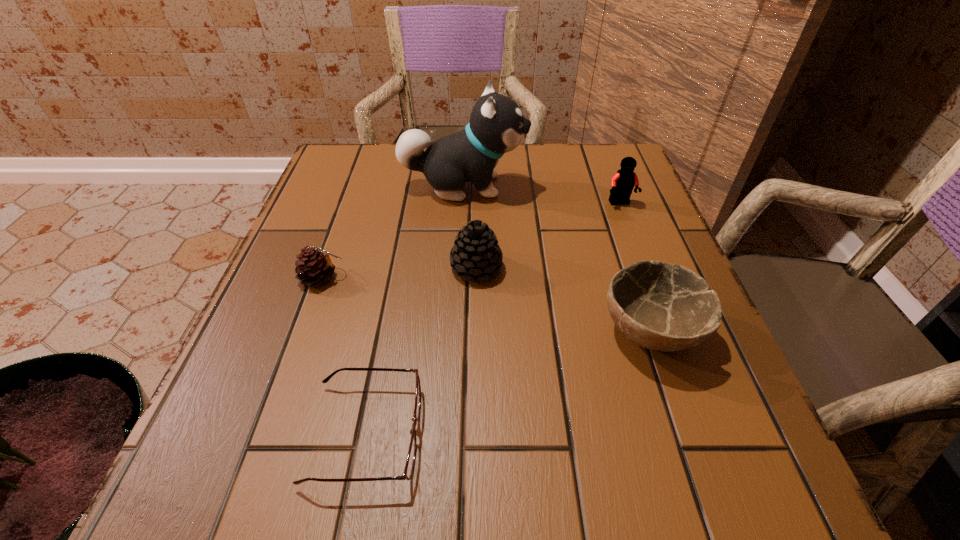
Where is `free space located on the front-facing side of the Lego`? This screenshot has height=540, width=960. free space located on the front-facing side of the Lego is located at coordinates (659, 305).

You are a GUI agent. You are given a task and a screenshot of the screen. Output one action in this format:
    pyautogui.click(x=<x>, y=<y>)
    Task: Click on the vacant region located at the narrow end of the taller pinecone
    
    Given the screenshot: What is the action you would take?
    (619, 268)

You are a GUI agent. You are given a task and a screenshot of the screen. Output one action in this format:
    pyautogui.click(x=<x>, y=<y>)
    Task: Click on the blank space located 0.150m on the left of the third shortest object
    
    Given the screenshot: What is the action you would take?
    pyautogui.click(x=513, y=332)

Image resolution: width=960 pixels, height=540 pixels. In order to click on free spot located with a leaf charm attached to the leftmost object in this screenshot , I will do `click(454, 278)`.

Locate an element on the screen. free space located on the lenses of the shortest object is located at coordinates (609, 433).

Where is `object that is at the far edge`? The width and height of the screenshot is (960, 540). object that is at the far edge is located at coordinates (496, 126).

The height and width of the screenshot is (540, 960). I want to click on object situated at the near edge, so click(x=410, y=461).

Where is `pinecone that is at the left edge`? Image resolution: width=960 pixels, height=540 pixels. pinecone that is at the left edge is located at coordinates (314, 267).

At what (x,y) coordinates should I click in order to perform the action: click on spectacles positioned at the left edge. Please return your answer as a coordinate pair (x, y). The height and width of the screenshot is (540, 960). Looking at the image, I should click on (410, 461).

This screenshot has height=540, width=960. I want to click on Lego that is positioned at the right edge, so click(x=622, y=183).